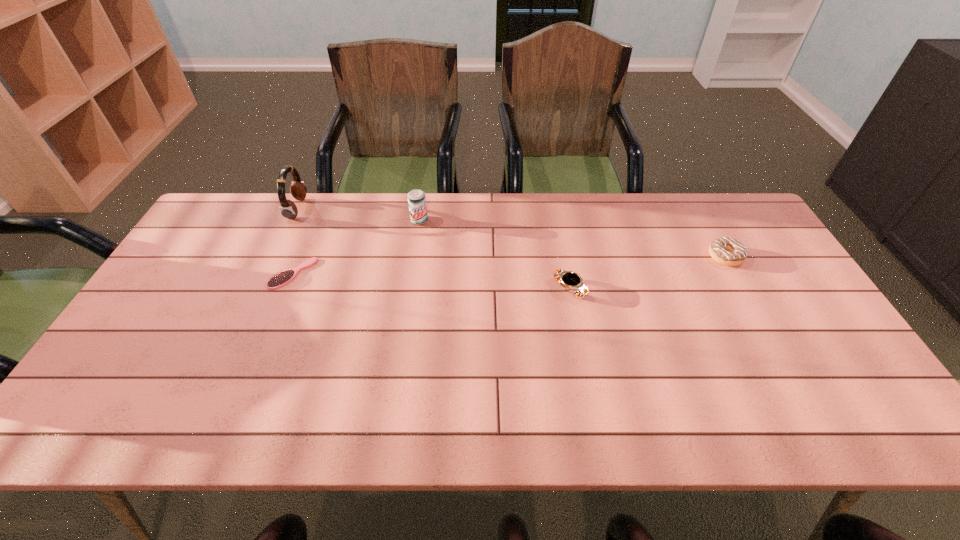
At what (x,y) coordinates should I click in order to perform the action: click on the tallest object. Please return your answer as a coordinate pair (x, y). Looking at the image, I should click on (288, 209).

Locate an element on the screen. This screenshot has height=540, width=960. the third object from left to right is located at coordinates (416, 198).

You are a GUI agent. You are given a task and a screenshot of the screen. Output one action in this format:
    pyautogui.click(x=<x>, y=<y>)
    Task: Click on the fourth shortest object
    
    Given the screenshot: What is the action you would take?
    pyautogui.click(x=416, y=198)

Locate an element on the screen. The width and height of the screenshot is (960, 540). the rightmost object is located at coordinates (725, 250).

You are a GUI agent. You are given a task and a screenshot of the screen. Output one action in this format:
    pyautogui.click(x=<x>, y=<y>)
    Task: Click on the watch
    This screenshot has height=540, width=960.
    Given the screenshot: What is the action you would take?
    pyautogui.click(x=570, y=281)

At what (x,y) coordinates should I click in order to perform the action: click on the shortest object. Please return your answer as a coordinate pair (x, y). This screenshot has height=540, width=960. Looking at the image, I should click on (280, 279).

Find the location of a particular element. The height and width of the screenshot is (540, 960). vacant point located on the ear cup of the tallest object is located at coordinates (346, 209).

Where is `vacant space located on the front of the beer can`? This screenshot has height=540, width=960. vacant space located on the front of the beer can is located at coordinates (411, 276).

Locate an element on the screen. blank area located on the left of the doughnut is located at coordinates (602, 256).

This screenshot has height=540, width=960. I want to click on vacant space located 0.070m on the front of the watch, so click(576, 323).